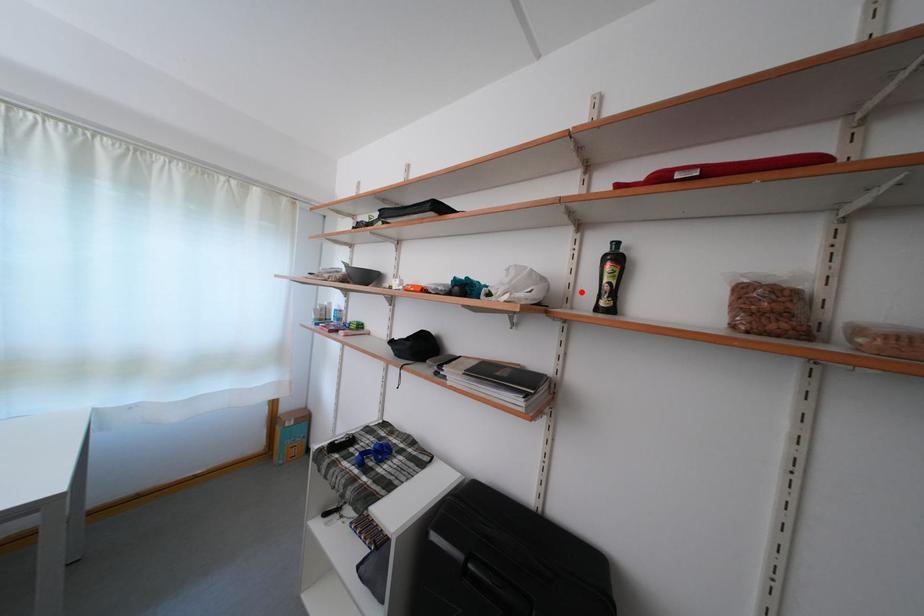
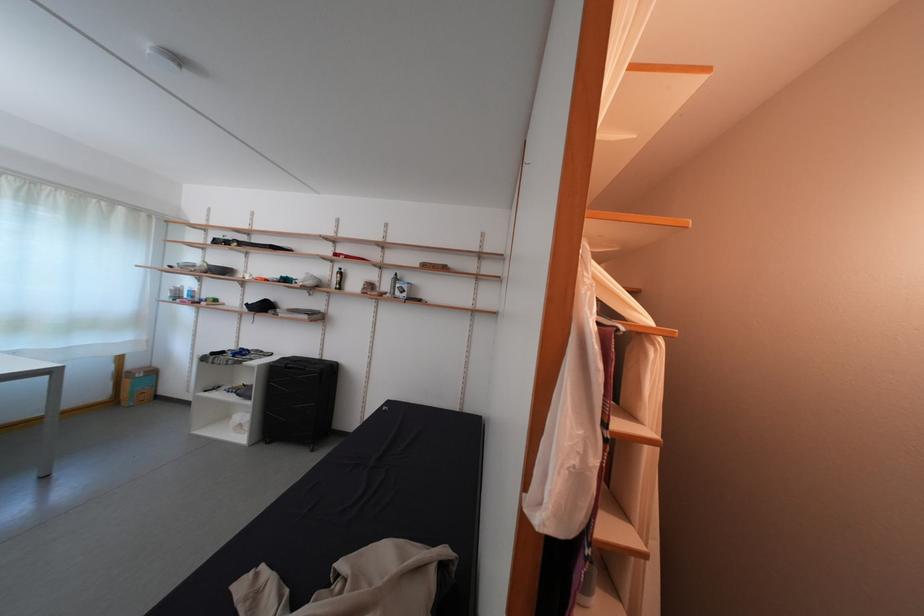
Locate, in the second image, the point that corresponds to the highlighted location in the first image.

(339, 286)